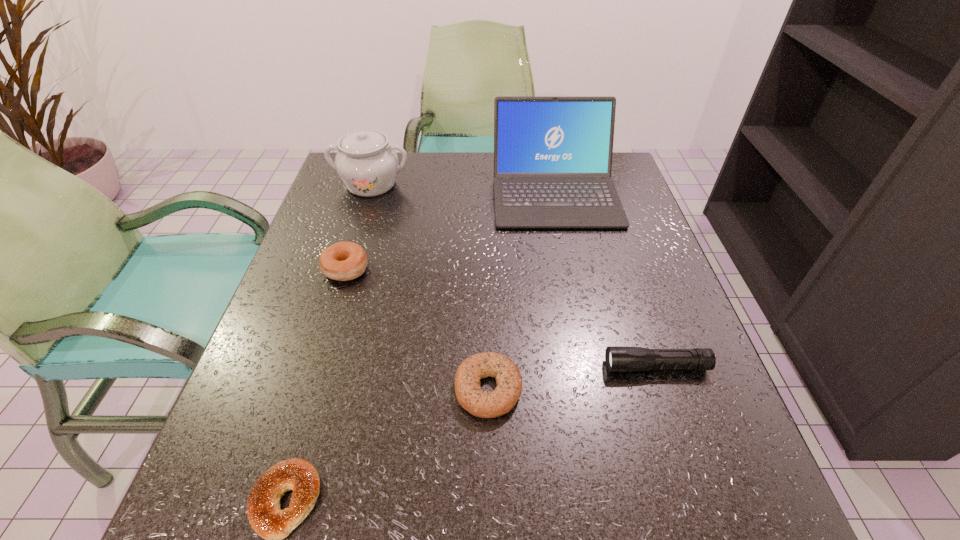
Find the location of a particular element. vacant area that lies between the second shortest bagel and the tallest bagel is located at coordinates (417, 329).

The height and width of the screenshot is (540, 960). Identify the location of vacant area that lies between the fourth nearest object and the flashlight. (501, 318).

The width and height of the screenshot is (960, 540). Find the location of `empty location between the second shortest bagel and the flashlight`. empty location between the second shortest bagel and the flashlight is located at coordinates (572, 377).

You are a GUI agent. You are given a task and a screenshot of the screen. Output one action in this format:
    pyautogui.click(x=<x>, y=<y>)
    Task: Click on the second closest object to the nearest object
    This screenshot has width=960, height=540.
    Given the screenshot: What is the action you would take?
    pyautogui.click(x=343, y=261)

This screenshot has width=960, height=540. I want to click on object that stands as the third closest to the nearest object, so click(x=617, y=358).

Identify which bagel is the nearest to the shortest bagel. Please provide its 2D coordinates. Your answer should be formatted as a tuple, i.e. [(x, y)], where the tuple contains the x and y coordinates of a point satisfying the conditions above.

[(479, 403)]

Identify the location of the second closest bagel to the rightmost bagel. (343, 261).